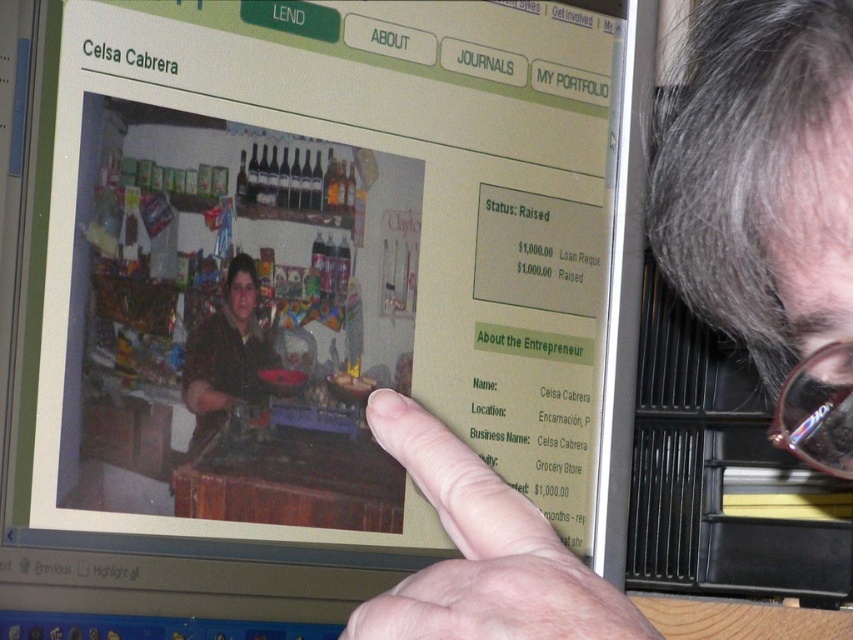
Question: Does skinny finger at upper right have a lesser width compared to clear plastic glasses at upper right?

Choices:
 (A) yes
 (B) no

Answer: (B)

Question: Among these objects, which one is nearest to the camera?

Choices:
 (A) clear plastic glasses at upper right
 (B) skinny finger at upper right

Answer: (B)

Question: Is skinny finger at upper right wider than clear plastic glasses at upper right?

Choices:
 (A) no
 (B) yes

Answer: (B)

Question: Does skinny finger at upper right appear over clear plastic glasses at upper right?

Choices:
 (A) no
 (B) yes

Answer: (A)

Question: Which point is closer to the camera taking this photo?

Choices:
 (A) (440, 520)
 (B) (850, 465)

Answer: (A)

Question: Which point appears closest to the camera in this image?

Choices:
 (A) (482, 472)
 (B) (782, 406)

Answer: (A)